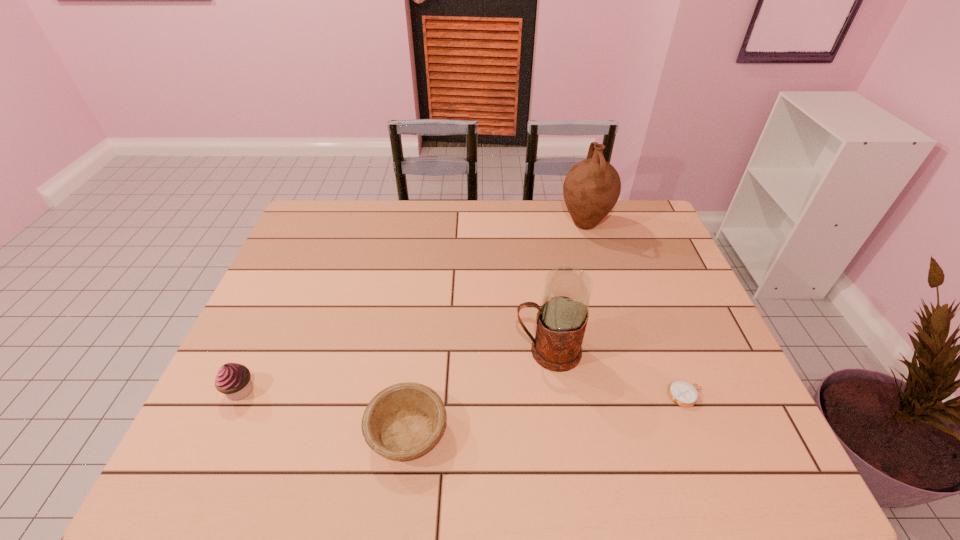
Identify the location of compass at the right edge. (683, 393).

The image size is (960, 540). I want to click on object located in the far right corner section of the desktop, so click(591, 189).

In the image, there is a desktop. Where is `free region at the far edge`? This screenshot has height=540, width=960. free region at the far edge is located at coordinates (430, 220).

This screenshot has height=540, width=960. In the image, there is a desktop. Identify the location of free region at the near edge. (442, 443).

At what (x,y) coordinates should I click in order to perform the action: click on vacant space at the left edge of the desktop. Please return your answer as a coordinate pair (x, y). Looking at the image, I should click on (259, 341).

You are a GUI agent. You are given a task and a screenshot of the screen. Output one action in this format:
    pyautogui.click(x=<x>, y=<y>)
    Task: Click on the free space at the right edge of the desktop
    This screenshot has height=540, width=960.
    Given the screenshot: What is the action you would take?
    pyautogui.click(x=708, y=420)

Image resolution: width=960 pixels, height=540 pixels. Find the location of `vacant space at the far left corner of the desktop`. vacant space at the far left corner of the desktop is located at coordinates (342, 230).

This screenshot has width=960, height=540. Find the location of `free space at the far right corner`. free space at the far right corner is located at coordinates (638, 240).

Find the location of a particular element. The width and height of the screenshot is (960, 540). vacant space at the near right corner of the desktop is located at coordinates (729, 453).

At what (x,y) coordinates should I click in order to perform the action: click on vacant space that is in between the taller pitcher and the leftmost object. Please return your answer as a coordinate pair (x, y). The width and height of the screenshot is (960, 540). Looking at the image, I should click on (413, 307).